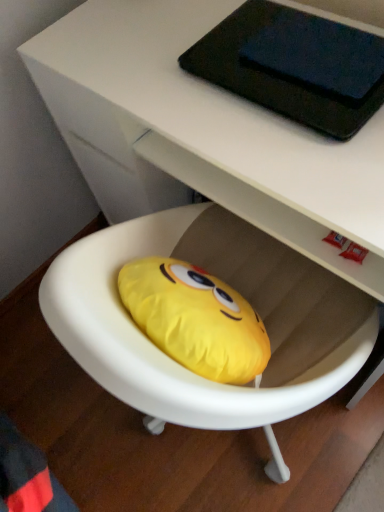
Image resolution: width=384 pixels, height=512 pixels. In order to click on free point in front of black matte tablet at upper center in this screenshot , I will do `click(309, 163)`.